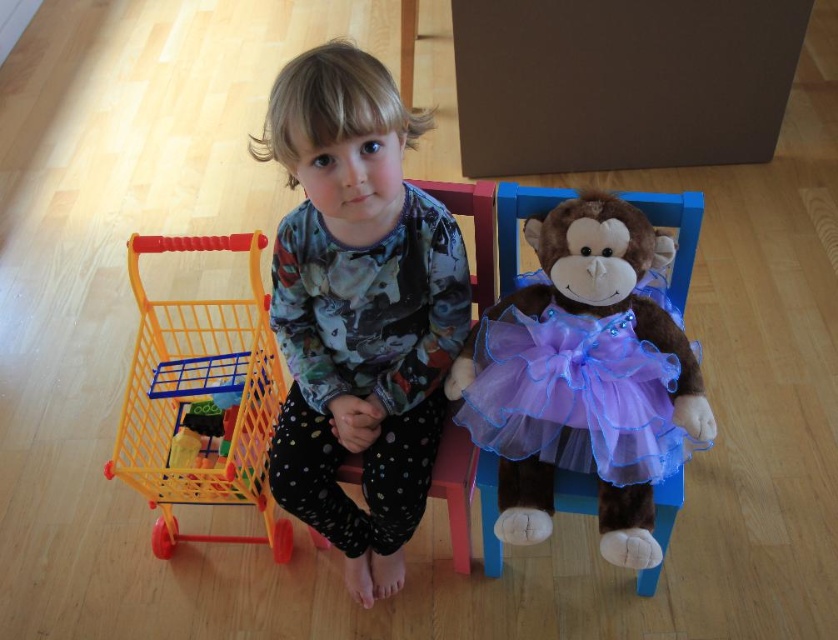
Question: Can you confirm if purple tulle monkey at center is positioned below yellow plastic shopping cart at left?

Choices:
 (A) no
 (B) yes

Answer: (A)

Question: Which is farther from the matte floral pajamas at center?

Choices:
 (A) purple tulle monkey at center
 (B) yellow plastic shopping cart at left

Answer: (B)

Question: Does purple tulle monkey at center have a lesser width compared to yellow plastic shopping cart at left?

Choices:
 (A) yes
 (B) no

Answer: (A)

Question: Where is matte floral pajamas at center located in relation to purple tulle monkey at center in the image?

Choices:
 (A) left
 (B) right

Answer: (A)

Question: Considering the real-world distances, which object is closest to the matte floral pajamas at center?

Choices:
 (A) yellow plastic shopping cart at left
 (B) purple tulle monkey at center

Answer: (B)

Question: Which point is farther from the camera taking this photo?

Choices:
 (A) (229, 387)
 (B) (350, 220)
 (C) (639, 490)

Answer: (A)